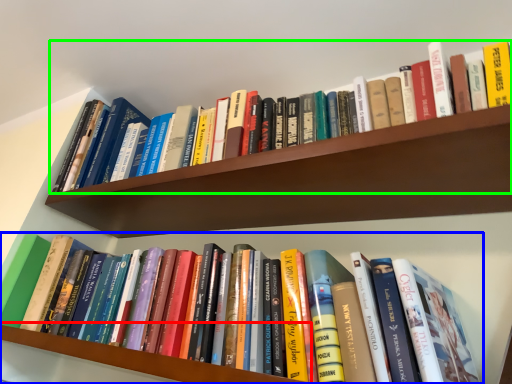
Question: Based on their relative distances, which object is farther from shelf (highlighted by a red box)? Choose from book (highlighted by a blue box) and book (highlighted by a green box).

Choices:
 (A) book
 (B) book

Answer: (B)